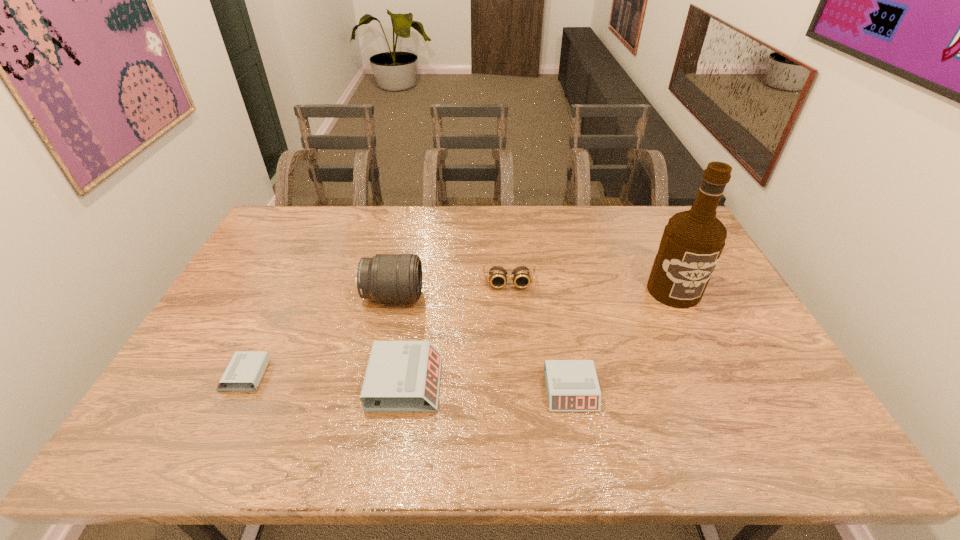
Please point a spot to add another alarm clock on the right. Please provide its 2D coordinates. Your answer should be formatted as a tuple, i.e. [(x, y)], where the tuple contains the x and y coordinates of a point satisfying the conditions above.

[(741, 399)]